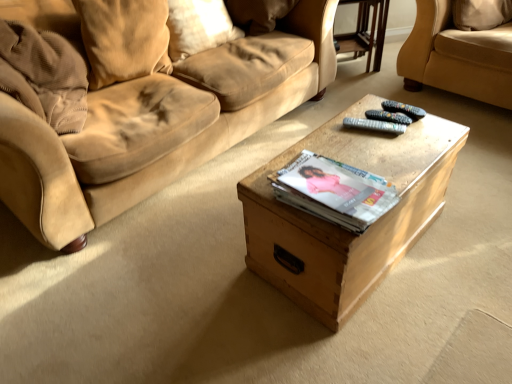
Locate an element on the screen. The height and width of the screenshot is (384, 512). vacant area that lies to the right of black plastic remote at center, arranged as the second remote when viewed from the top is located at coordinates (426, 129).